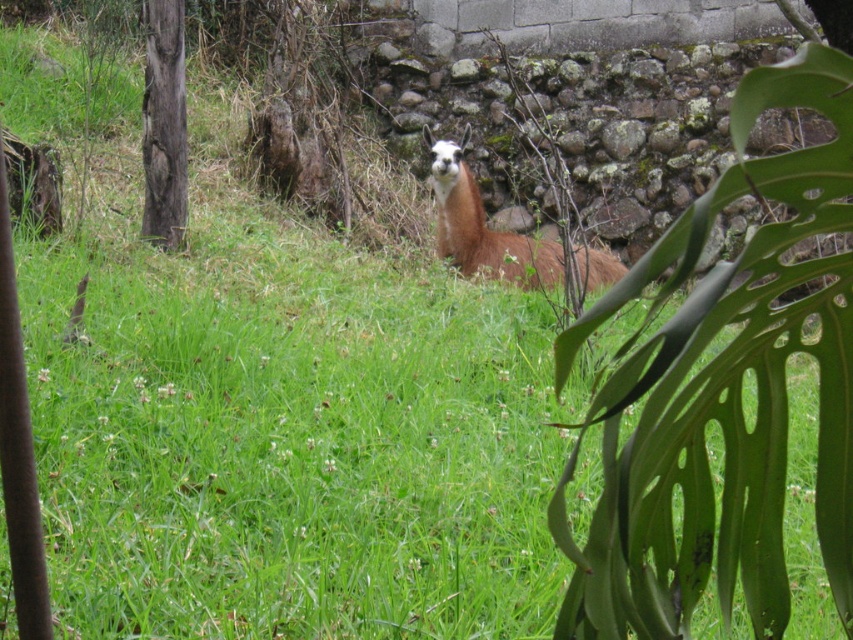
Question: Which object is closer to the camera taking this photo?

Choices:
 (A) brown woolly alpaca at center
 (B) dark brown rough bark tree at left

Answer: (A)

Question: Which point is farther to the camera?

Choices:
 (A) brown woolly alpaca at center
 (B) dark brown rough bark tree at left

Answer: (B)

Question: Does brown woolly alpaca at center appear on the right side of dark brown rough bark tree at left?

Choices:
 (A) no
 (B) yes

Answer: (B)

Question: Is brown woolly alpaca at center above dark brown rough bark tree at left?

Choices:
 (A) no
 (B) yes

Answer: (A)

Question: Does brown woolly alpaca at center have a smaller size compared to dark brown rough bark tree at left?

Choices:
 (A) no
 (B) yes

Answer: (A)